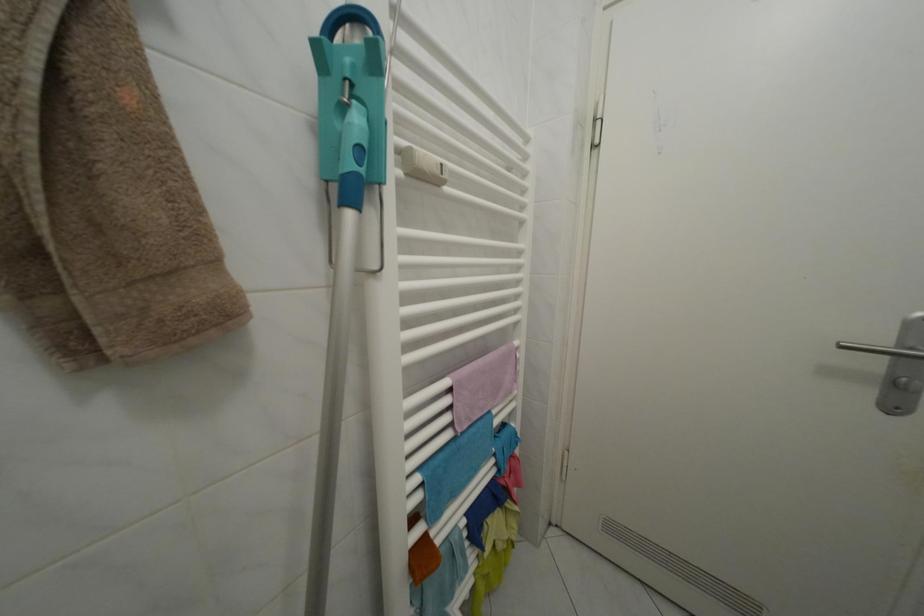
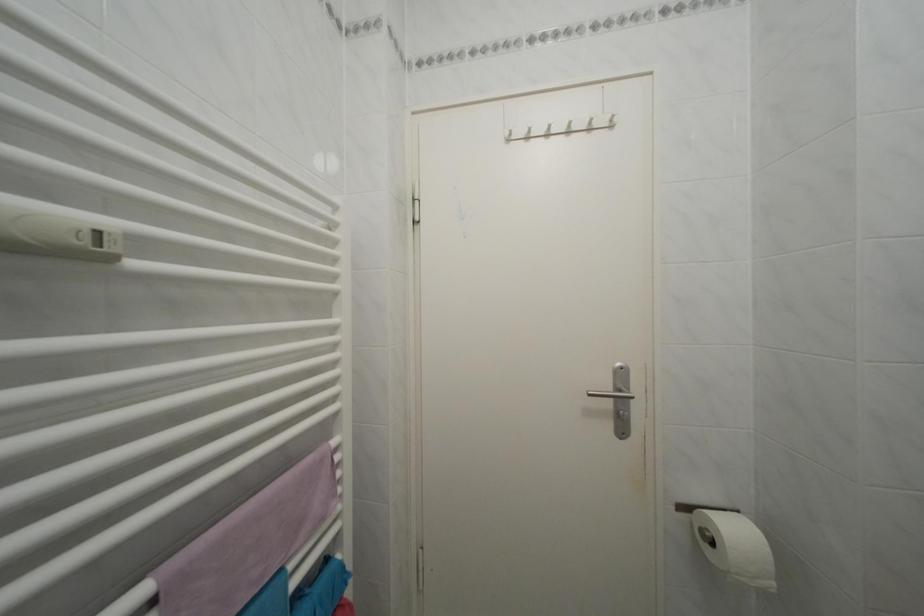
Question: The camera is either moving clockwise (left) or counter-clockwise (right) around the object. The first image is from the beginning of the video and the second image is from the end. Is the camera moving left or right when shooting the video?

Choices:
 (A) Left
 (B) Right

Answer: (A)